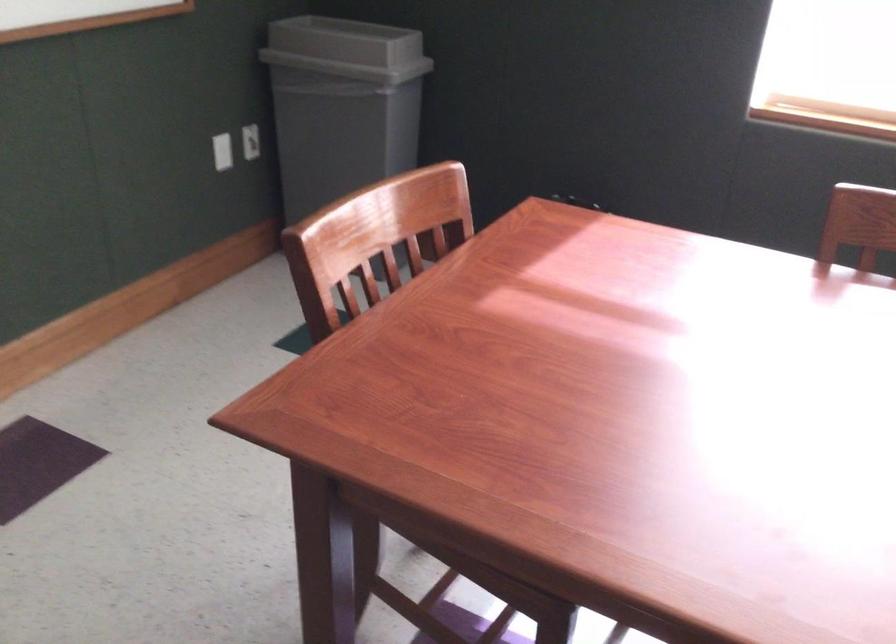
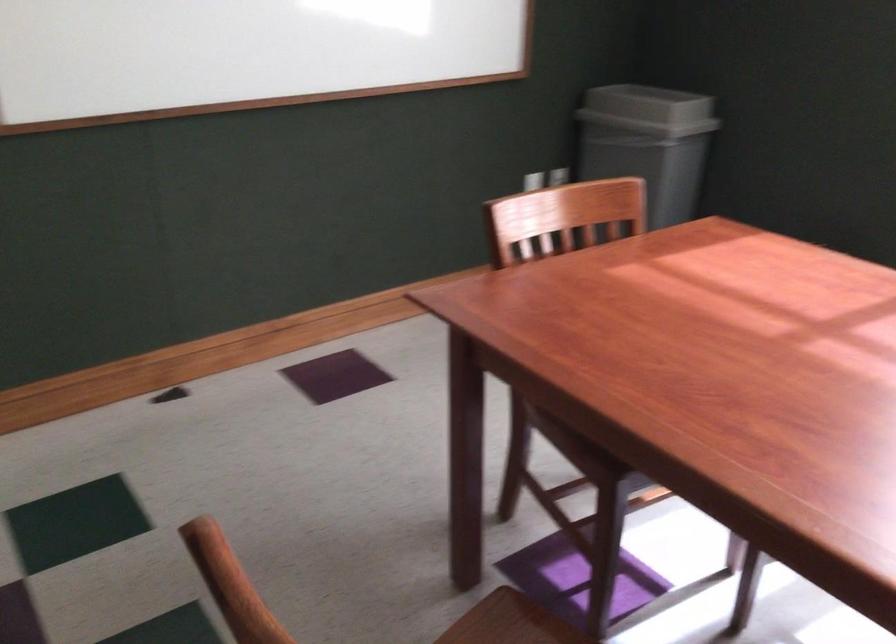
Where in the second image is the point corresponding to the point at 476,573 from the first image?

(570, 453)